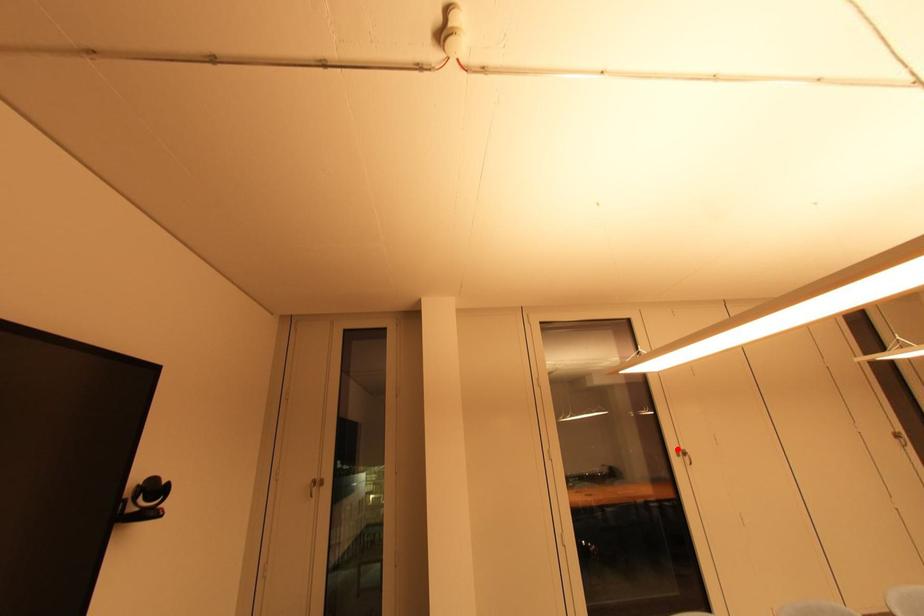
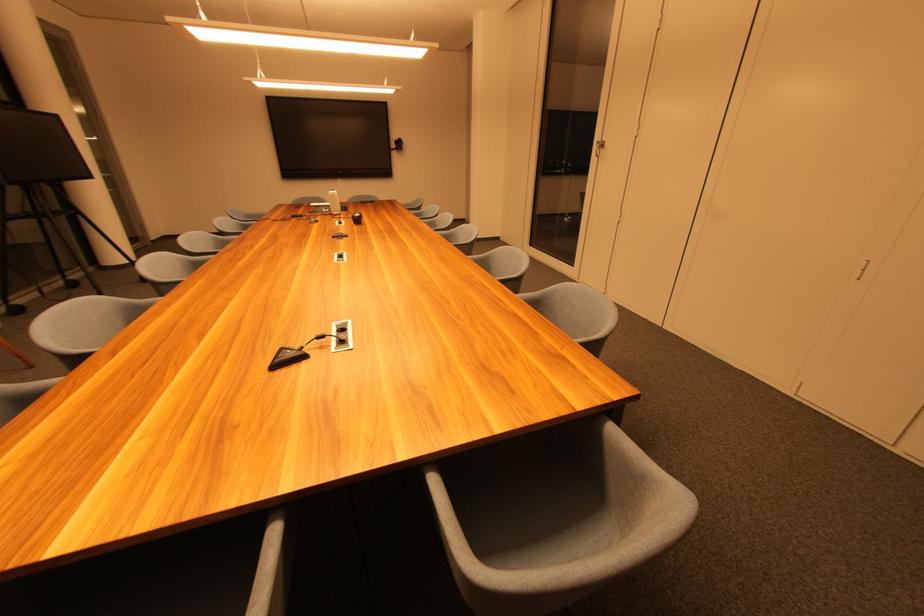
Question: I am providing you with two images of the same scene from different viewpoints. In image1, a red point is highlighted. Considering the same 3D point in image2, which of the following is correct?

Choices:
 (A) It is closer
 (B) It is farther

Answer: (A)